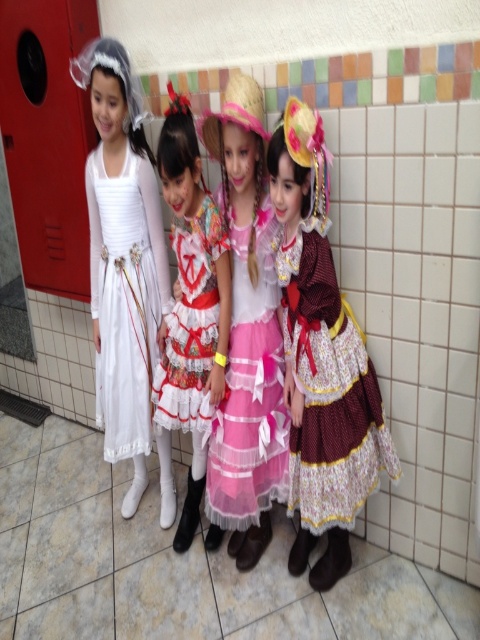
Does point (363, 349) come closer to viewer compared to point (98, 209)?

That is True.

Identify the location of maroon satin dress at right. (328, 390).

Based on the photo, who is positioned more to the left, white satin dress at left or floral lace dress at center?

Positioned to the left is white satin dress at left.

Does white satin dress at left appear on the right side of floral lace dress at center?

In fact, white satin dress at left is to the left of floral lace dress at center.

Describe the element at coordinates (126, 298) in the screenshot. I see `white satin dress at left` at that location.

Locate an element on the screen. The image size is (480, 640). white satin dress at left is located at coordinates (126, 298).

Does white satin dress at left appear under pink tulle dress at center?

Actually, white satin dress at left is above pink tulle dress at center.

Is point (134, 348) positioned after point (257, 472)?

Yes.

Identify the location of white satin dress at left. The width and height of the screenshot is (480, 640). (126, 298).